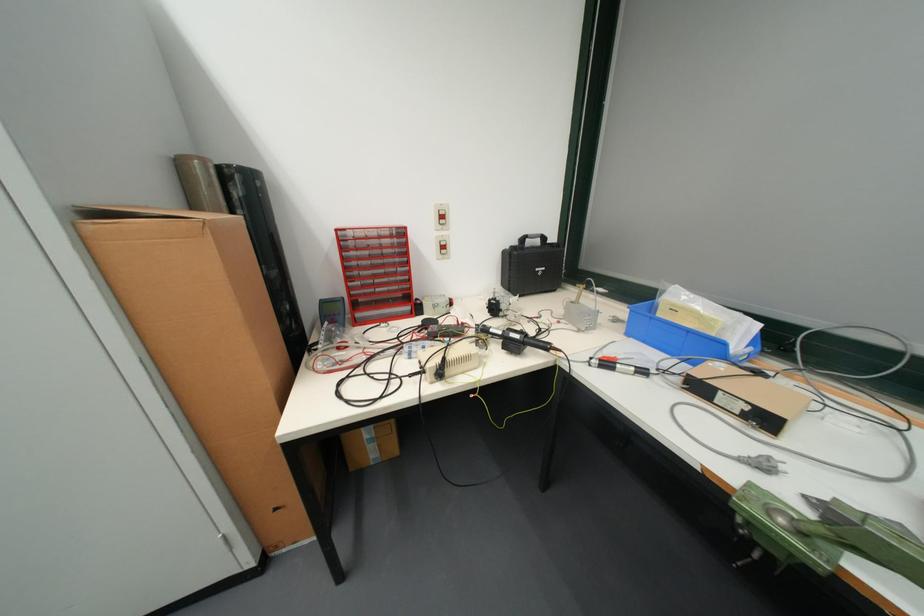
You are a GUI agent. You are given a task and a screenshot of the screen. Output one action in this format:
    pyautogui.click(x=<x>, y=<y>)
    Task: Click on the black case handle
    
    Given the screenshot: What is the action you would take?
    point(531,238)